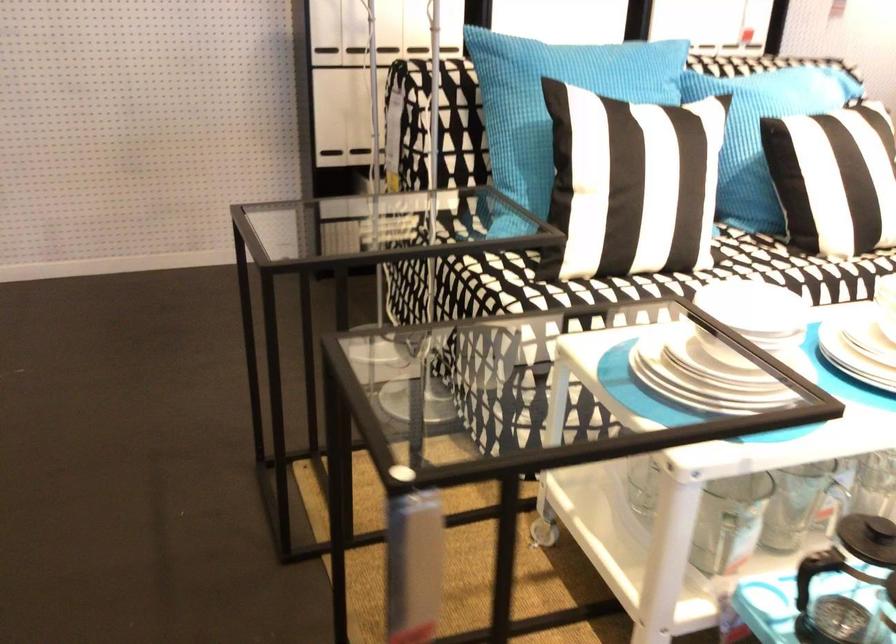
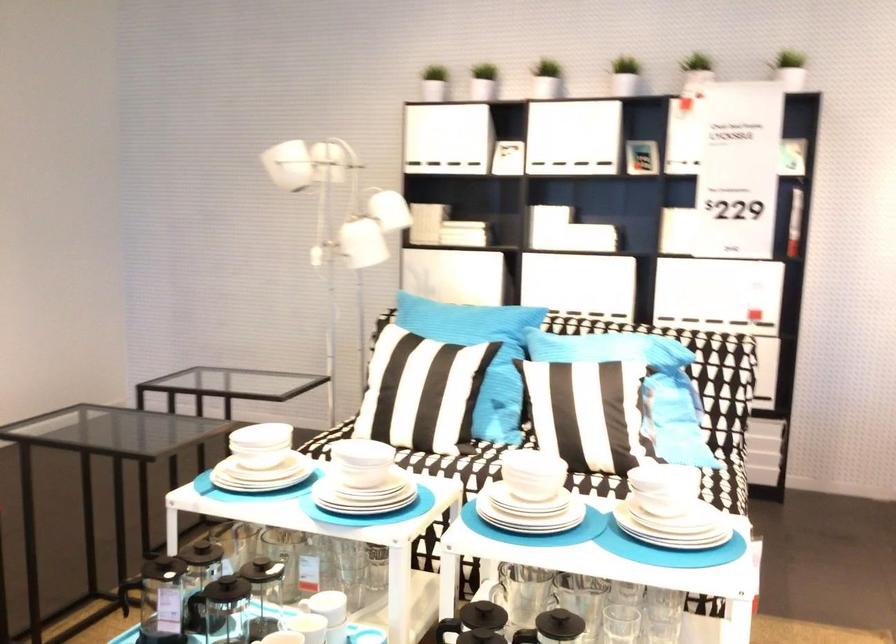
Question: I am providing you with two images of the same scene from different viewpoints. After the viewpoint changes to image2, which objects are now occluded?

Choices:
 (A) white drawer handle
 (B) white ceramic bowl
 (C) blue document feeder
 (D) black press plunger

Answer: (A)